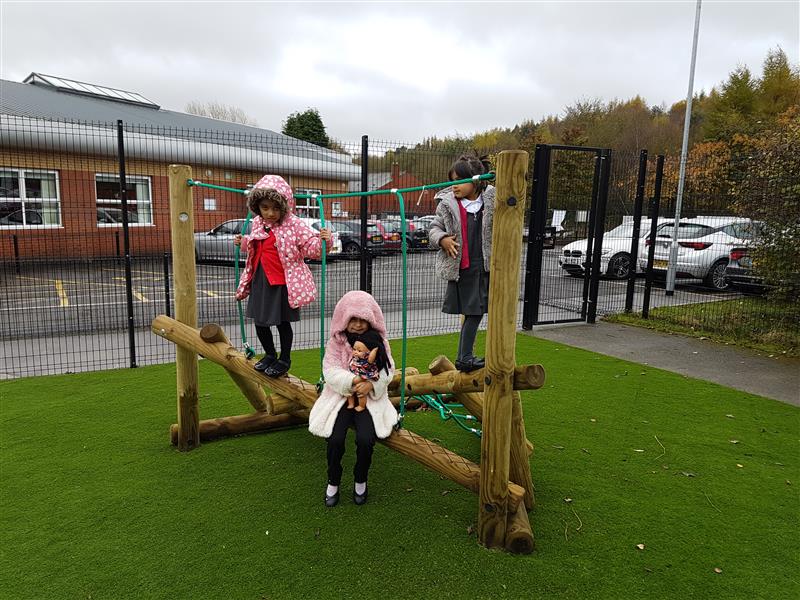
I want to click on window, so click(x=33, y=185), click(x=10, y=214), click(x=108, y=209), click(x=138, y=191).